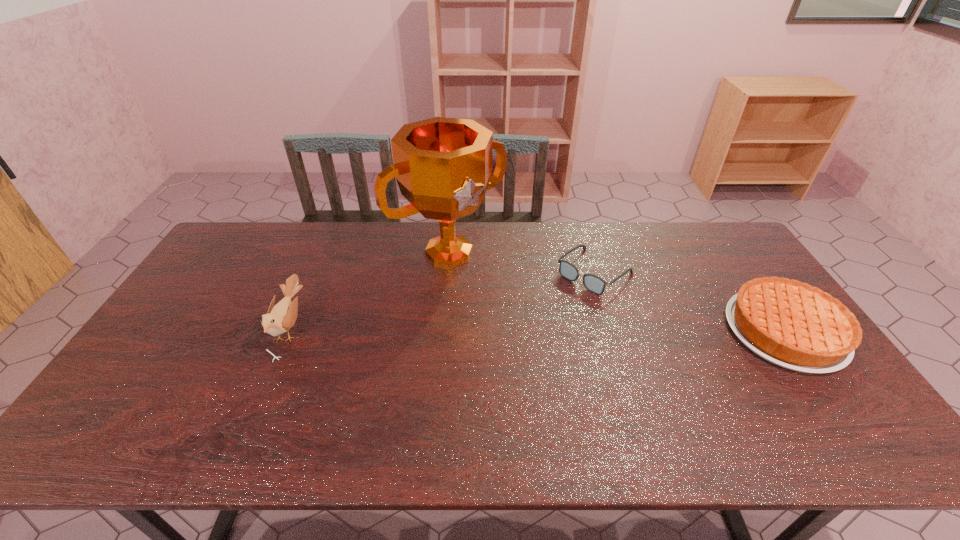
Locate an element on the screen. vacant space on the desktop that is between the third shortest object and the pie and is positioned on the face of the spectacles is located at coordinates (x=530, y=329).

Locate an element on the screen. The image size is (960, 540). free space on the desktop that is between the leftmost object and the pie and is positioned on the side of the second object from left to right with the star emblem is located at coordinates (526, 329).